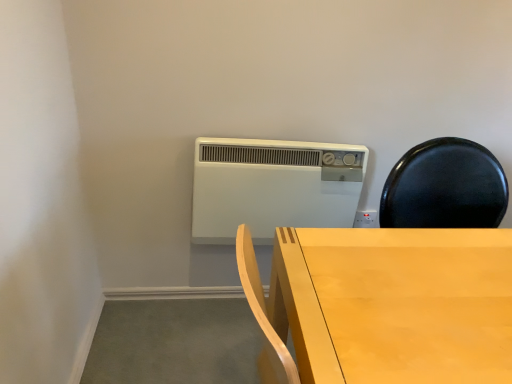
Question: Considering the relative positions of light wood table at center and white plastic heater at upper center in the image provided, is light wood table at center to the left or to the right of white plastic heater at upper center?

Choices:
 (A) right
 (B) left

Answer: (A)

Question: From their relative heights in the image, would you say light wood table at center is taller or shorter than white plastic heater at upper center?

Choices:
 (A) short
 (B) tall

Answer: (B)

Question: From the image's perspective, is light wood table at center positioned above or below white plastic heater at upper center?

Choices:
 (A) above
 (B) below

Answer: (B)

Question: Considering the positions of white plastic heater at upper center and light wood table at center in the image, is white plastic heater at upper center bigger or smaller than light wood table at center?

Choices:
 (A) big
 (B) small

Answer: (B)

Question: From a real-world perspective, is white plastic heater at upper center physically located above or below light wood table at center?

Choices:
 (A) below
 (B) above

Answer: (A)

Question: Considering the positions of white plastic heater at upper center and light wood table at center in the image, is white plastic heater at upper center taller or shorter than light wood table at center?

Choices:
 (A) tall
 (B) short

Answer: (B)

Question: Is white plastic heater at upper center to the left or to the right of light wood table at center in the image?

Choices:
 (A) left
 (B) right

Answer: (A)